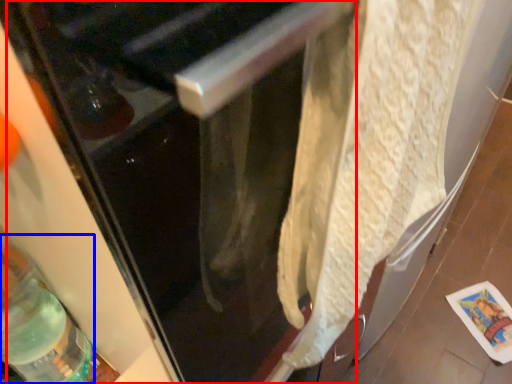
Question: Which point is further to the camera, screen door (highlighted by a red box) or bottle (highlighted by a blue box)?

Choices:
 (A) screen door
 (B) bottle

Answer: (B)